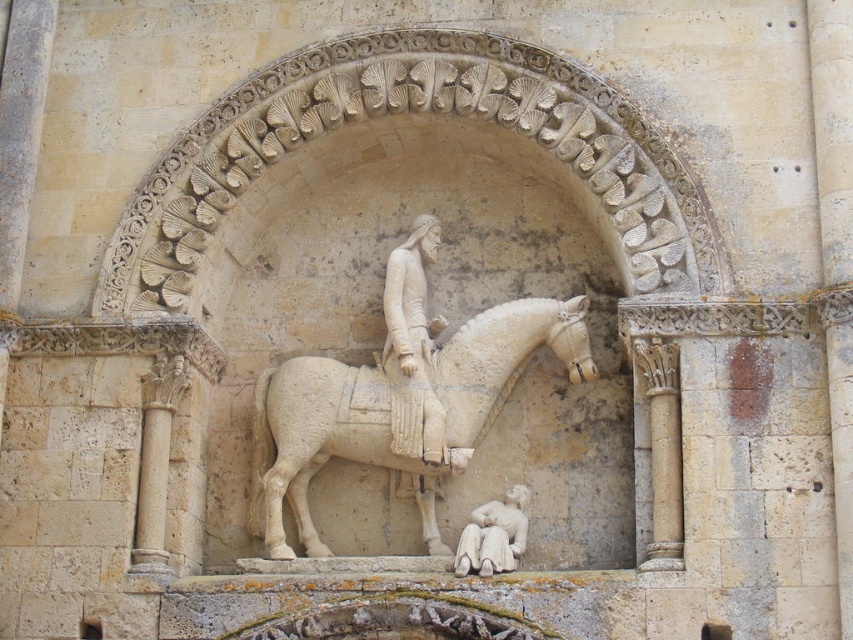
You are an art conservator assessing the stone relief sculpture. You need to determine which object has a greater width for structural analysis. Which one is wider between the white stone statue at center and the white stone reclining figure at lower center?

The white stone statue at center is wider than the white stone reclining figure at lower center according to the description.

You are an art conservator examining the stone relief sculpture on the cathedral facade. You need to clean both the white stone horse at center and the white stone reclining figure at lower center. If you start from the left side of the sculpture, which object should you clean first?

The white stone horse at center should be cleaned first because it is positioned on the left side of the white stone reclining figure at lower center, so starting from the left would mean encountering the horse before the reclining figure.